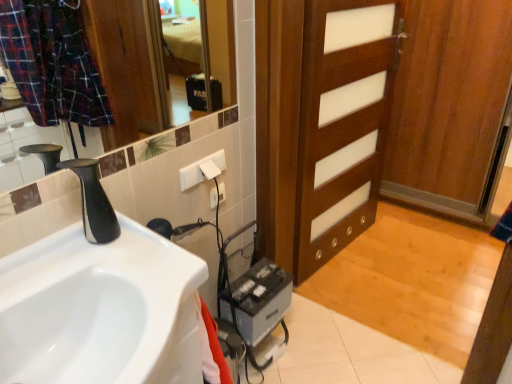
Question: Should I look upward or downward to see gray metallic battery at lower center?

Choices:
 (A) down
 (B) up

Answer: (A)

Question: Is gray metallic battery at lower center far away from black matte faucet at left?

Choices:
 (A) yes
 (B) no

Answer: (B)

Question: Is gray metallic battery at lower center bigger than black matte faucet at left?

Choices:
 (A) no
 (B) yes

Answer: (B)

Question: Is gray metallic battery at lower center wider than black matte faucet at left?

Choices:
 (A) no
 (B) yes

Answer: (B)

Question: Does gray metallic battery at lower center come in front of black matte faucet at left?

Choices:
 (A) yes
 (B) no

Answer: (B)

Question: Considering the relative sizes of gray metallic battery at lower center and black matte faucet at left in the image provided, is gray metallic battery at lower center smaller than black matte faucet at left?

Choices:
 (A) yes
 (B) no

Answer: (B)

Question: From a real-world perspective, is gray metallic battery at lower center below black matte faucet at left?

Choices:
 (A) no
 (B) yes

Answer: (B)

Question: Could white plastic electric outlet at upper center, the second electric outlet from the back, be considered to be inside black matte faucet at left?

Choices:
 (A) no
 (B) yes

Answer: (A)

Question: Does black matte faucet at left come behind white plastic electric outlet at upper center, the first electric outlet positioned from the front?

Choices:
 (A) no
 (B) yes

Answer: (A)

Question: From the image's perspective, is black matte faucet at left above white plastic electric outlet at upper center, the second electric outlet from the back?

Choices:
 (A) yes
 (B) no

Answer: (B)

Question: From a real-world perspective, is black matte faucet at left located higher than white plastic electric outlet at upper center, the first electric outlet positioned from the front?

Choices:
 (A) yes
 (B) no

Answer: (A)

Question: Is black matte faucet at left positioned with its back to white plastic electric outlet at upper center, the second electric outlet from the back?

Choices:
 (A) yes
 (B) no

Answer: (B)

Question: Considering the relative sizes of black matte faucet at left and white plastic electric outlet at upper center, the first electric outlet positioned from the front, in the image provided, is black matte faucet at left smaller than white plastic electric outlet at upper center, the first electric outlet positioned from the front,?

Choices:
 (A) no
 (B) yes

Answer: (A)

Question: Is white glossy sink at lower left aimed at wooden door at center?

Choices:
 (A) no
 (B) yes

Answer: (A)